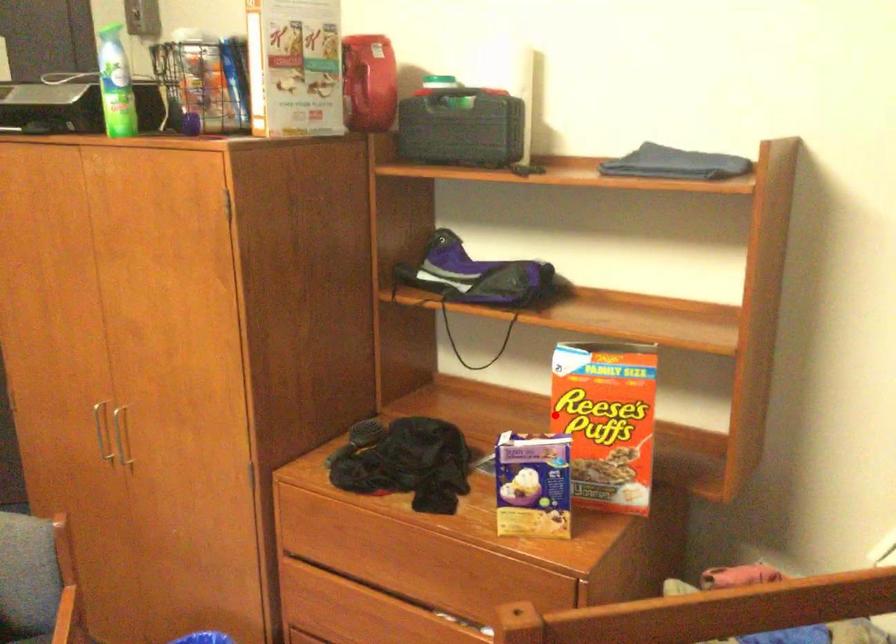
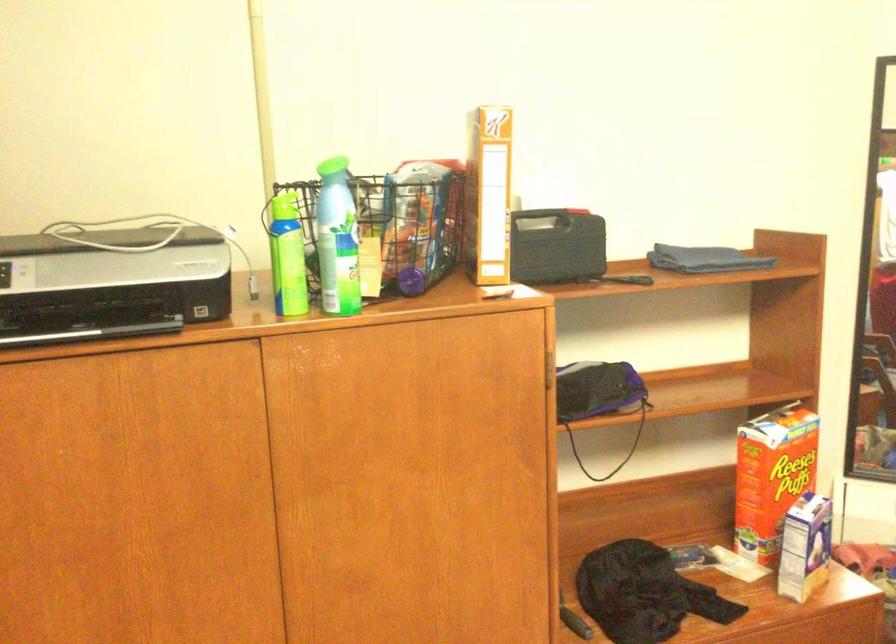
Question: I am providing you with two images of the same scene from different viewpoints. In image1, a red point is highlighted. Considering the same 3D point in image2, which of the following is correct?

Choices:
 (A) It is closer
 (B) It is farther

Answer: (B)